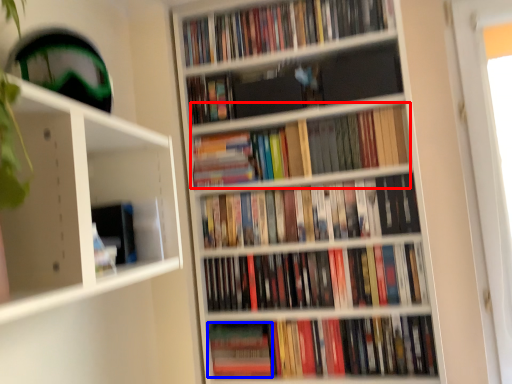
Question: Which object is further to the camera taking this photo, book (highlighted by a red box) or paperback book (highlighted by a blue box)?

Choices:
 (A) book
 (B) paperback book

Answer: (B)